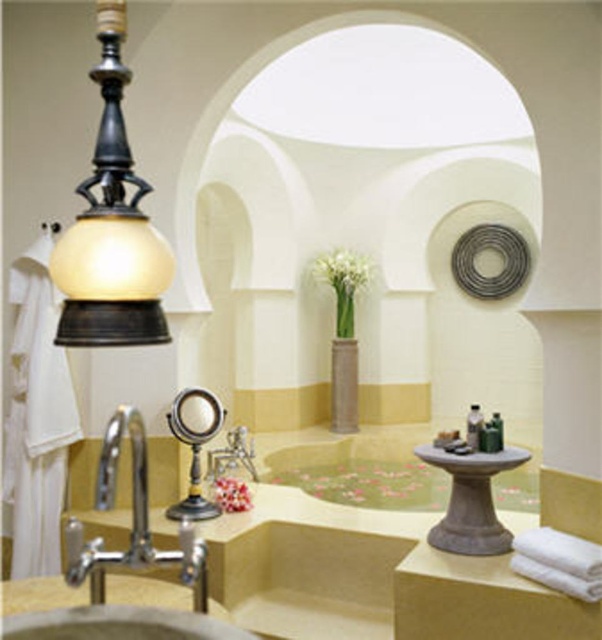
Question: Is satin nickel sink at lower left smaller than matte stone pillar at center?

Choices:
 (A) yes
 (B) no

Answer: (A)

Question: Considering the real-world distances, which object is farthest from the matte black lamp at left?

Choices:
 (A) satin nickel sink at lower left
 (B) silver metallic faucet at lower left
 (C) matte stone pillar at center
 (D) smooth stone bath at center

Answer: (C)

Question: Observing the image, what is the correct spatial positioning of matte black lamp at left in reference to smooth stone bath at center?

Choices:
 (A) right
 (B) left

Answer: (B)

Question: Can you confirm if matte black lamp at left is positioned below silver metallic faucet at lower left?

Choices:
 (A) yes
 (B) no

Answer: (B)

Question: Which of the following is the farthest from the observer?

Choices:
 (A) satin nickel sink at lower left
 (B) matte stone pillar at center

Answer: (B)

Question: Which point is farther from the camera taking this photo?

Choices:
 (A) (343, 477)
 (B) (341, 358)
 (C) (117, 412)

Answer: (B)